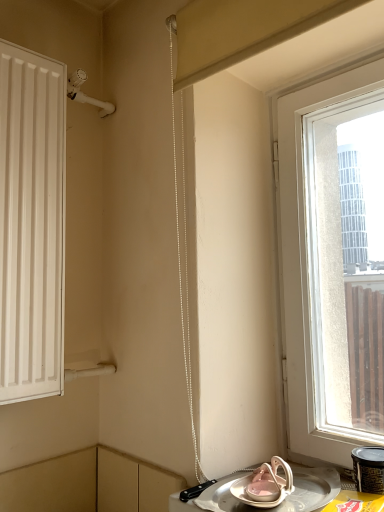
In order to face metallic silver tray at lower right, should I rotate leftwards or rightwards?

Rotate your view right by about 8.925°.

This screenshot has height=512, width=384. Describe the element at coordinates (306, 259) in the screenshot. I see `transparent glass window at right` at that location.

Where is `black plastic container at lower right`? black plastic container at lower right is located at coordinates (369, 469).

Considering the sizes of black plastic container at lower right and transparent glass window at right in the image, is black plastic container at lower right taller or shorter than transparent glass window at right?

black plastic container at lower right is shorter than transparent glass window at right.

Between point (355, 468) and point (325, 102), which one is positioned in front?

The point (355, 468) is in front.

Could you tell me if black plastic container at lower right is facing transparent glass window at right?

No, black plastic container at lower right is not facing towards transparent glass window at right.

Locate an element on the screen. appliance lying below the transparent glass window at right (from the image's perspective) is located at coordinates (369, 469).

Is transparent glass window at right taller than black plastic container at lower right?

Correct, transparent glass window at right is much taller as black plastic container at lower right.

Is transparent glass window at right looking in the opposite direction of black plastic container at lower right?

transparent glass window at right does not have its back to black plastic container at lower right.

Is point (332, 453) positioned in front of point (360, 480)?

No, (332, 453) is behind (360, 480).

Considering the positions of objects metallic silver tray at lower right and black plastic container at lower right in the image provided, who is in front, metallic silver tray at lower right or black plastic container at lower right?

metallic silver tray at lower right.

Looking at the image, does metallic silver tray at lower right seem bigger or smaller compared to black plastic container at lower right?

Considering their sizes, metallic silver tray at lower right takes up more space than black plastic container at lower right.

From the image's perspective, is metallic silver tray at lower right beneath black plastic container at lower right?

Yes.

Is metallic silver tray at lower right spatially inside black plastic container at lower right, or outside of it?

metallic silver tray at lower right lies outside black plastic container at lower right.

Measure the distance between transparent glass window at right and metallic silver tray at lower right.

transparent glass window at right is 36.97 centimeters away from metallic silver tray at lower right.

Considering the positions of point (287, 146) and point (333, 488), is point (287, 146) closer or farther from the camera than point (333, 488)?

Point (287, 146) is positioned farther from the camera compared to point (333, 488).

Is transparent glass window at right positioned before metallic silver tray at lower right?

No.

Is transparent glass window at right facing towards metallic silver tray at lower right?

Yes, transparent glass window at right is facing metallic silver tray at lower right.

Is metallic silver tray at lower right not within transparent glass window at right?

metallic silver tray at lower right lies outside transparent glass window at right's area.

How much distance is there between metallic silver tray at lower right and transparent glass window at right?

metallic silver tray at lower right is 14.56 inches from transparent glass window at right.

Does metallic silver tray at lower right appear on the right side of transparent glass window at right?

In fact, metallic silver tray at lower right is to the left of transparent glass window at right.

From a real-world perspective, between metallic silver tray at lower right and transparent glass window at right, who is vertically higher?

transparent glass window at right.

Is black plastic container at lower right to the left of metallic silver tray at lower right from the viewer's perspective?

No.

Considering the sizes of objects black plastic container at lower right and metallic silver tray at lower right in the image provided, who is shorter, black plastic container at lower right or metallic silver tray at lower right?

metallic silver tray at lower right is shorter.

The width and height of the screenshot is (384, 512). I want to click on table that is in front of the black plastic container at lower right, so click(x=276, y=506).

Find the location of a particular element. window located on the right of black plastic container at lower right is located at coordinates (306, 259).

I want to click on appliance that is under the transparent glass window at right (from a real-world perspective), so click(369, 469).

Based on their spatial positions, is metallic silver tray at lower right or black plastic container at lower right further from transparent glass window at right?

black plastic container at lower right lies further to transparent glass window at right than the other object.

Considering their positions, is black plastic container at lower right positioned further to transparent glass window at right than metallic silver tray at lower right?

black plastic container at lower right is further to transparent glass window at right.

Considering their positions, is black plastic container at lower right positioned closer to metallic silver tray at lower right than transparent glass window at right?

Among the two, black plastic container at lower right is located nearer to metallic silver tray at lower right.

From the image, which object appears to be farther from black plastic container at lower right, metallic silver tray at lower right or transparent glass window at right?

transparent glass window at right.

When comparing their distances from metallic silver tray at lower right, does transparent glass window at right or black plastic container at lower right seem closer?

black plastic container at lower right is closer to metallic silver tray at lower right.

Based on their spatial positions, is transparent glass window at right or metallic silver tray at lower right closer to black plastic container at lower right?

metallic silver tray at lower right is closer to black plastic container at lower right.

I want to click on appliance that lies between transparent glass window at right and metallic silver tray at lower right from top to bottom, so click(x=369, y=469).